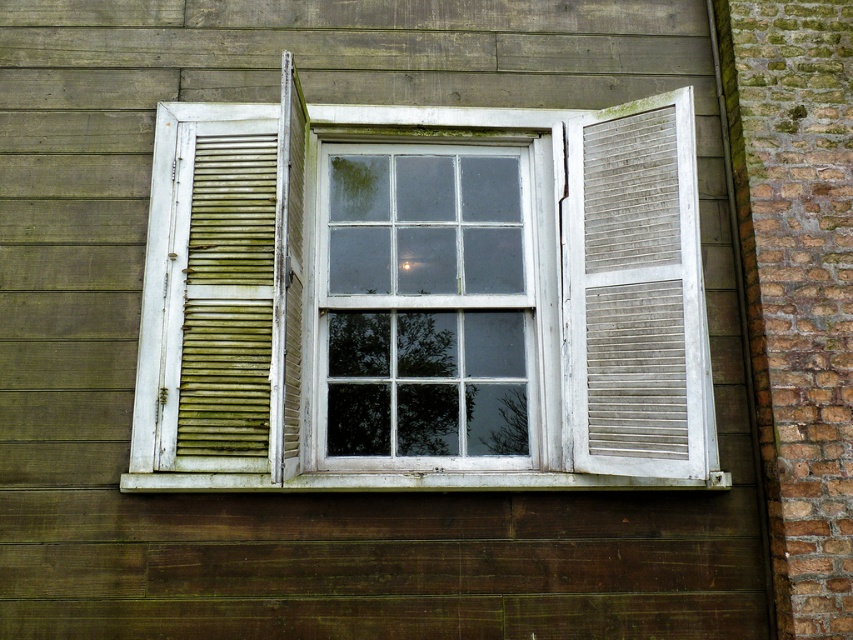
You are an architect analyzing the facade of a building. You notice two white windows on the wall. The first is labeled as white wood window at center, and the second is white wooden window at center. According to the scene description, which window is positioned to the right?

The white wood window at center is positioned to the right of the white wooden window at center.

You are an interior designer measuring the space between two windows in a room. You see the white wood window at center and the white wooden window at center. Are these two windows the same window? Explain your reasoning based on their distance apart.

The white wood window at center and the white wooden window at center are actually the same window. The description states that they are 5.18 inches apart, but since they are the same object with slightly different labels, the distance is likely a measurement error or a misinterpretation of the window panes.

You are standing outside the building looking at the window with white wooden shutters and the brickwork to the right. There is a point marked at coordinates (636, 369). Based on the scene description, what does this point likely indicate?

The point at (636, 369) marks the location of the white wood slats at right.